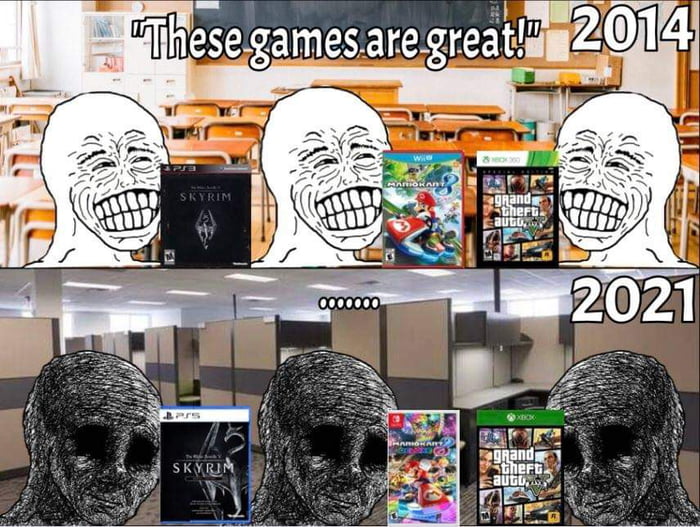
I want to click on office, so click(484, 308).